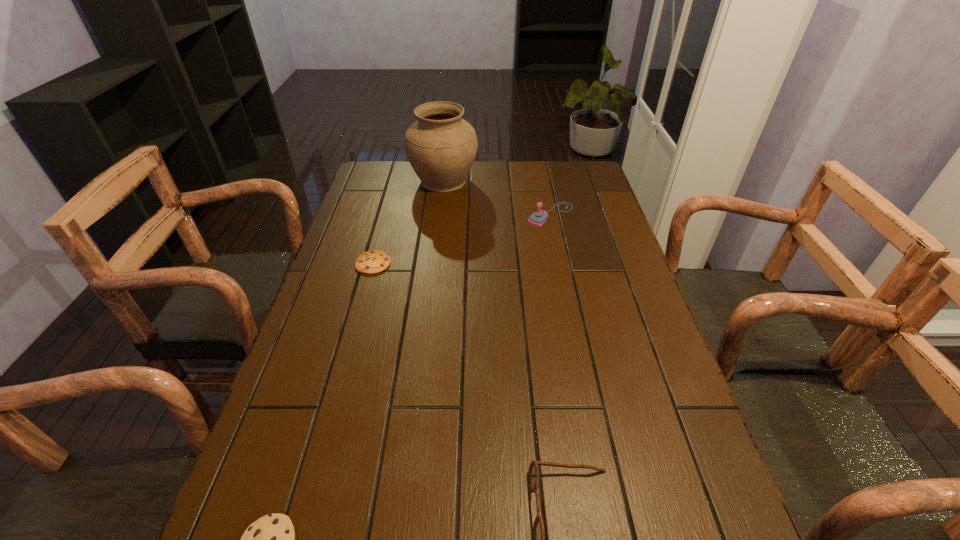
You are a GUI agent. You are given a task and a screenshot of the screen. Output one action in this format:
    pyautogui.click(x=<x>, y=<y>)
    Task: Click on the object positioned at the left edge
    
    Given the screenshot: What is the action you would take?
    pyautogui.click(x=374, y=261)

The height and width of the screenshot is (540, 960). Identify the location of object located at the right edge. (538, 218).

Find the location of a particular element. This screenshot has height=540, width=960. vacant space at the far edge of the desktop is located at coordinates (414, 180).

At what (x,y) coordinates should I click in order to perform the action: click on vacant space at the left edge of the desktop. Please return your answer as a coordinate pair (x, y). This screenshot has height=540, width=960. Looking at the image, I should click on (348, 228).

Find the location of a particular element. vacant region at the right edge of the desktop is located at coordinates (658, 531).

At what (x,y) coordinates should I click in order to perform the action: click on free space at the far left corner of the desktop. Please return your answer as a coordinate pair (x, y). Looking at the image, I should click on (361, 188).

Image resolution: width=960 pixels, height=540 pixels. Identify the location of vacant space at the far right corner. (557, 190).

Identify the location of empty location between the farther cookie and the urn. The width and height of the screenshot is (960, 540). (408, 222).

Image resolution: width=960 pixels, height=540 pixels. In order to click on vacant space that's between the third farthest object and the tallest object in this screenshot , I will do `click(408, 222)`.

At what (x,y) coordinates should I click in order to perform the action: click on vacant space that is in between the farthest object and the second tallest object. Please return your answer as a coordinate pair (x, y). The image size is (960, 540). Looking at the image, I should click on (497, 198).